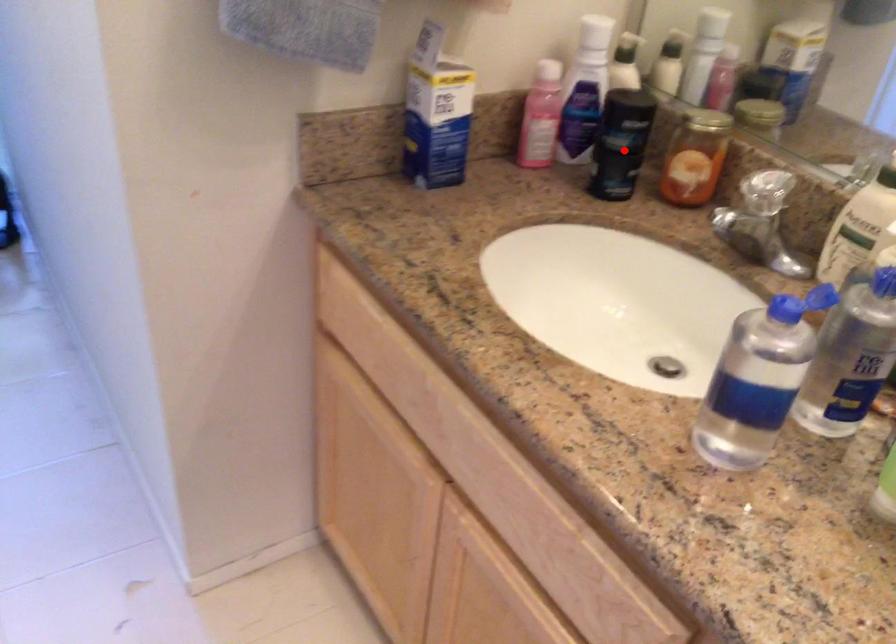
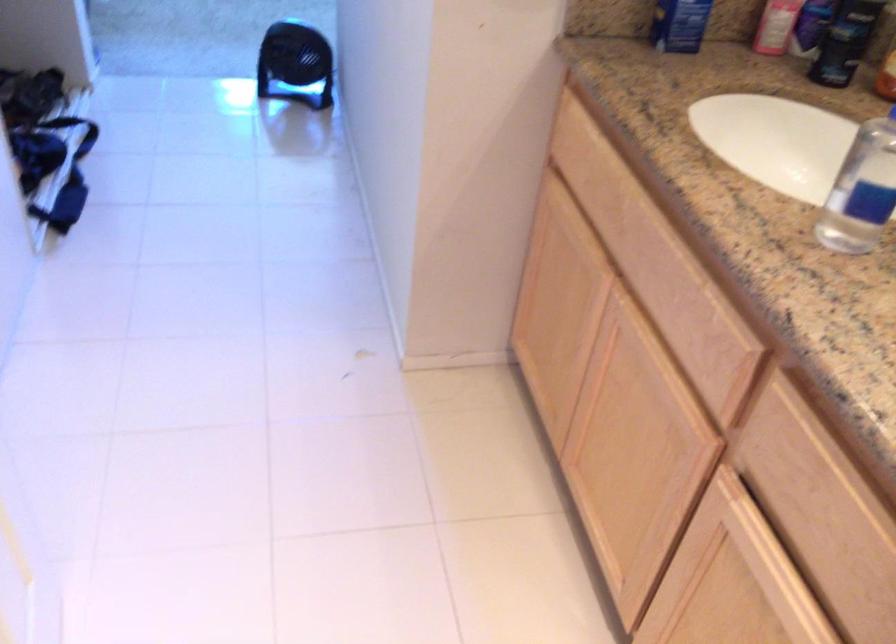
Question: I am providing you with two images of the same scene from different viewpoints. In image1, a red point is highlighted. Considering the same 3D point in image2, which of the following is correct?

Choices:
 (A) It is closer
 (B) It is farther

Answer: (B)